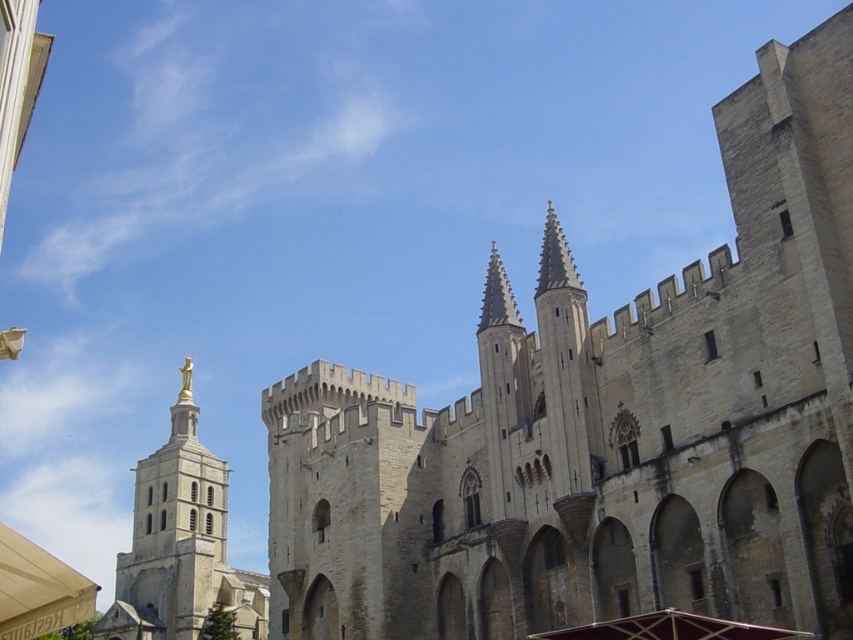
Is beige stone castle at center to the right of gold statue at center from the viewer's perspective?

Indeed, beige stone castle at center is positioned on the right side of gold statue at center.

Is point (752, 541) less distant than point (178, 410)?

Yes, it is.

Where is `beige stone castle at center`? The image size is (853, 640). beige stone castle at center is located at coordinates (607, 424).